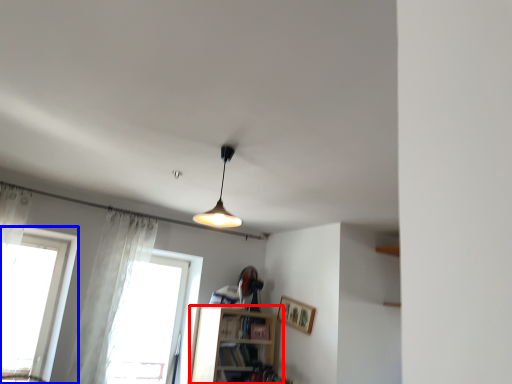
Question: Which object is further to the camera taking this photo, shelf (highlighted by a red box) or window (highlighted by a blue box)?

Choices:
 (A) shelf
 (B) window

Answer: (A)